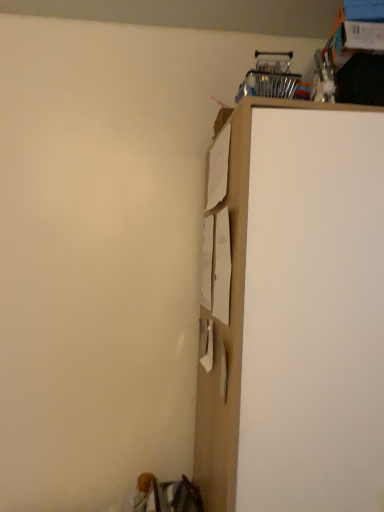
This screenshot has height=512, width=384. I want to click on wooden cabinet at upper right, so click(292, 310).

Image resolution: width=384 pixels, height=512 pixels. What do you see at coordinates (292, 310) in the screenshot? I see `wooden cabinet at upper right` at bounding box center [292, 310].

Where is `wooden cabinet at upper right`? Image resolution: width=384 pixels, height=512 pixels. wooden cabinet at upper right is located at coordinates (292, 310).